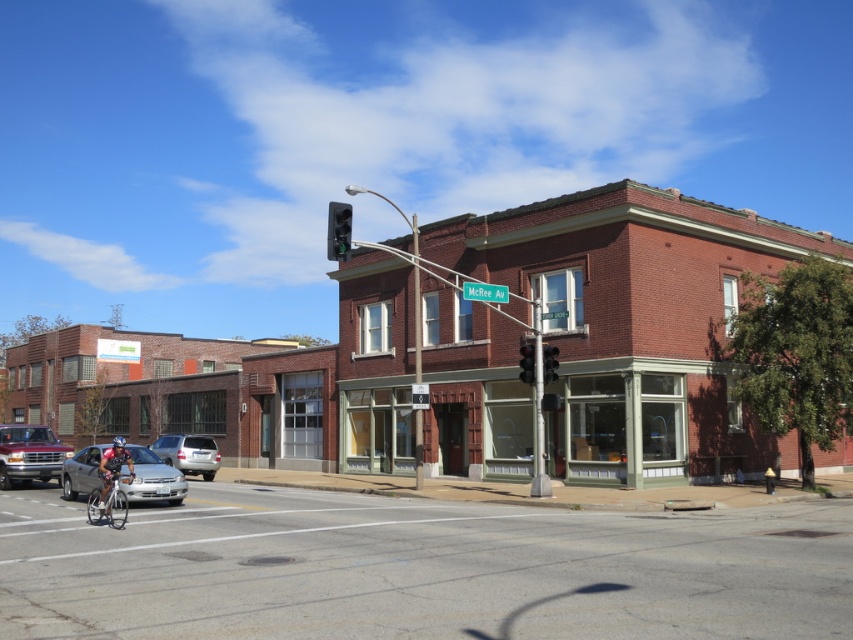
Question: Is the position of satin silver sedan at center less distant than that of black glass traffic light at center?

Choices:
 (A) yes
 (B) no

Answer: (B)

Question: Which object is the farthest from the brick building at center?

Choices:
 (A) satin silver sedan at center
 (B) silver metallic bicycle at lower left
 (C) silver metallic car at lower left

Answer: (A)

Question: Which point is farther from the camera taking this photo?

Choices:
 (A) (96, 493)
 (B) (339, 259)
 (C) (689, 301)

Answer: (C)

Question: Is metallic bicycle at lower left below satin silver sedan at center?

Choices:
 (A) no
 (B) yes

Answer: (A)

Question: Can you confirm if brick building at center is positioned to the left of black glass traffic light at center?

Choices:
 (A) no
 (B) yes

Answer: (B)

Question: Which object is the closest to the red cycling jersey at left?

Choices:
 (A) black glass traffic light at center
 (B) matte silver truck at lower left
 (C) black glass traffic light at upper center

Answer: (B)